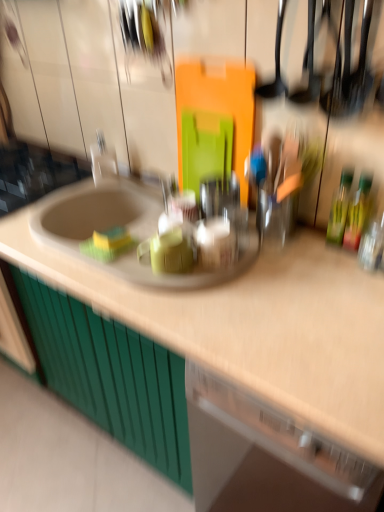
Find the location of a particular element. The image size is (384, 512). vacant area in front of green glass bottle at right, which ranks as the 2th bottle in right-to-left order is located at coordinates (331, 272).